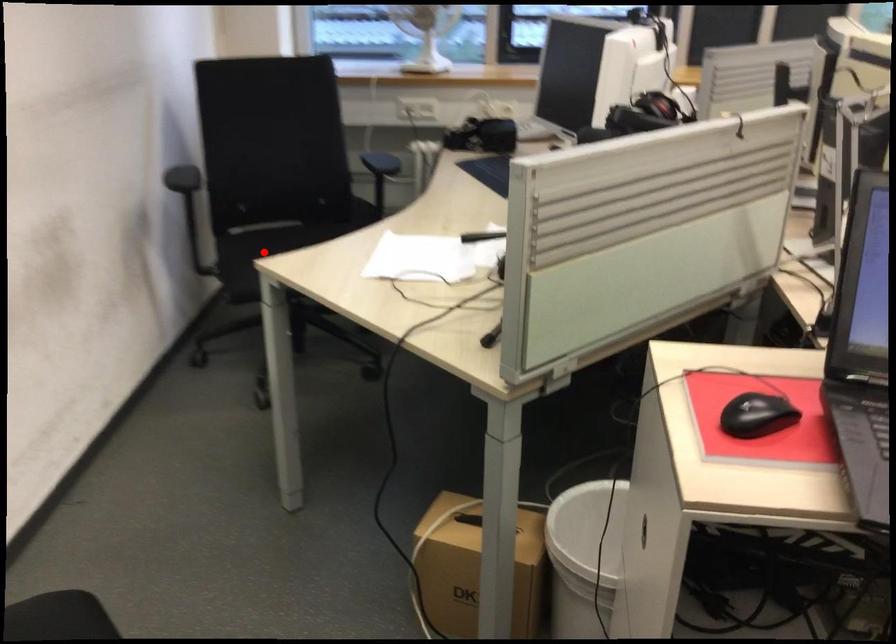
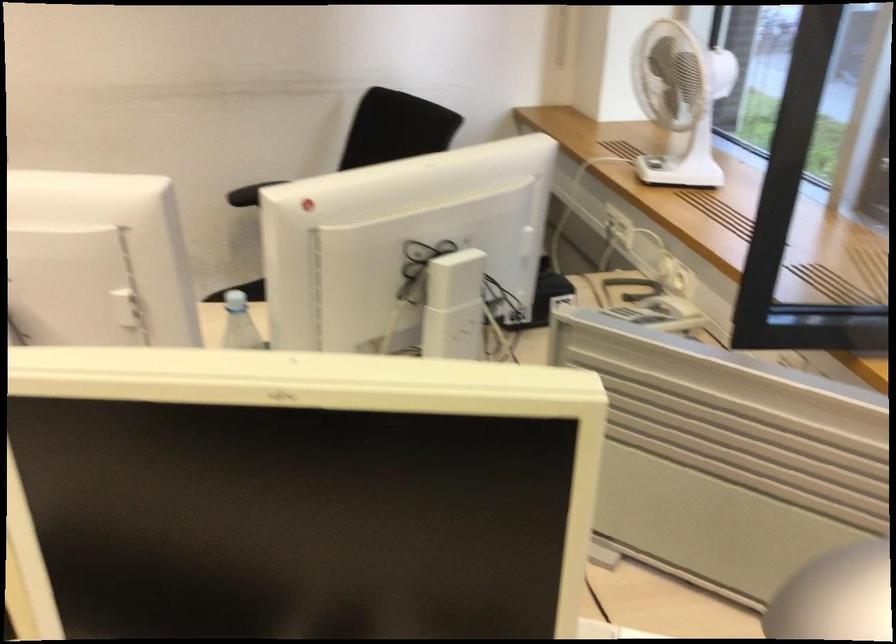
Question: I am providing you with two images of the same scene from different viewpoints. A red point is marked on the first image. At the location where the point appears in image 1, is it still visible in image 2?

Choices:
 (A) Yes
 (B) No

Answer: (B)